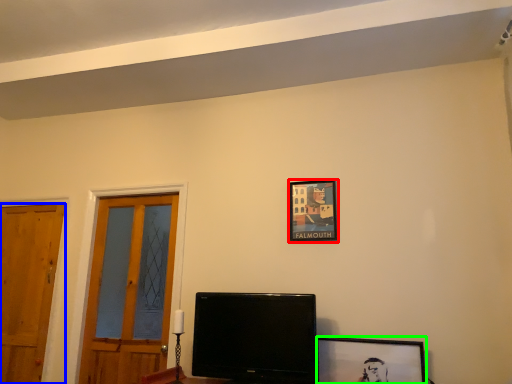
Question: Considering the real-world distances, which object is closest to picture frame (highlighted by a red box)? door (highlighted by a blue box) or picture frame (highlighted by a green box).

Choices:
 (A) door
 (B) picture frame

Answer: (B)